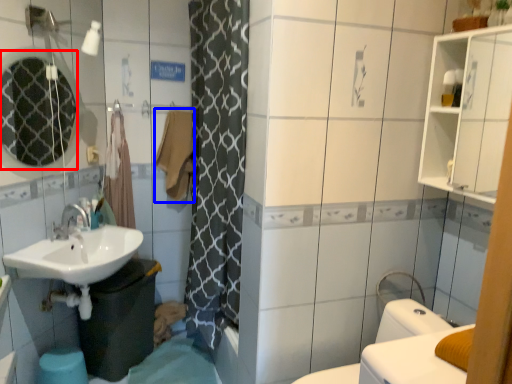
Question: Which of the following is the farthest to the observer, mirror (highlighted by a red box) or bath towel (highlighted by a blue box)?

Choices:
 (A) mirror
 (B) bath towel

Answer: (B)